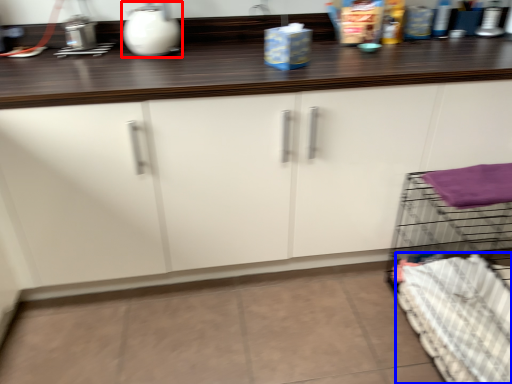
Question: Which point is closer to the camera, appliance (highlighted by a red box) or bedding (highlighted by a blue box)?

Choices:
 (A) appliance
 (B) bedding

Answer: (B)